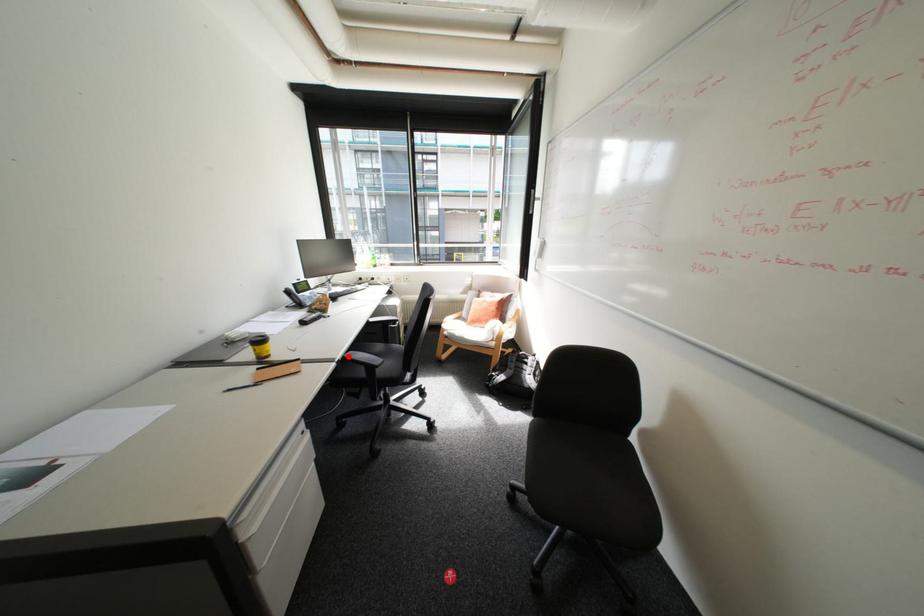
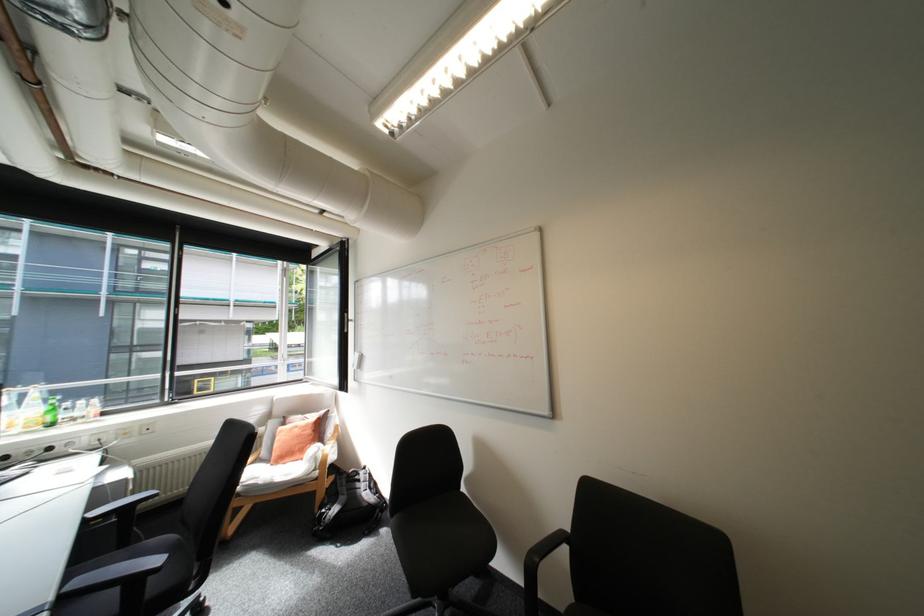
Where in the second image is the point corresponding to the highlighted location from the first image?

(61, 598)